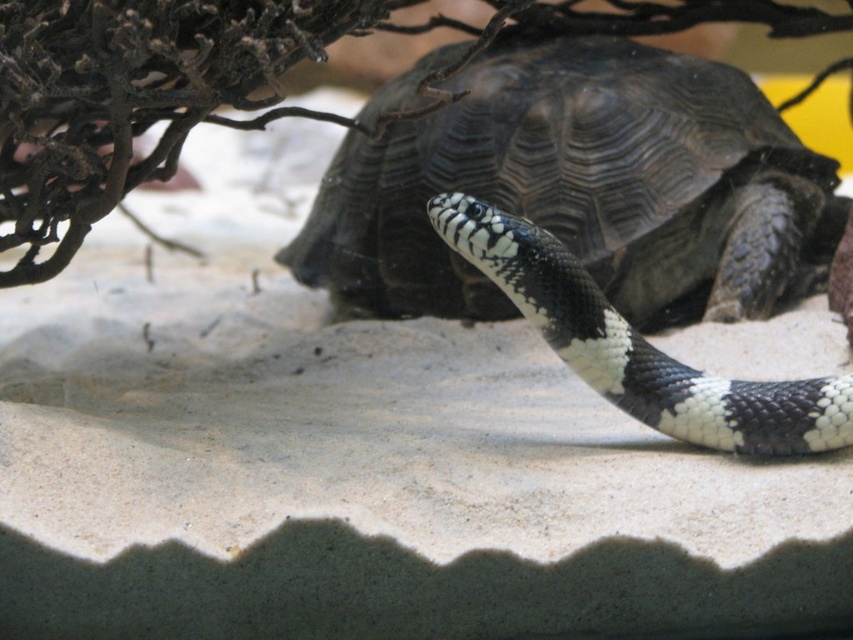
You are an animal caretaker looking into the enclosure. You need to place a new feeding dish between the shiny black tortoise at center and the black and white scales at center. Where should you place it so it is between them?

The shiny black tortoise at center is on the left side of black and white scales at center, so place the feeding dish between them to the right of the shiny black tortoise at center and to the left of the black and white scales at center.

You are a zookeeper observing a terrarium with a shiny black tortoise at center and a black and white scales at center. Which animal is bigger?

The shiny black tortoise at center is larger than the black and white scales at center.